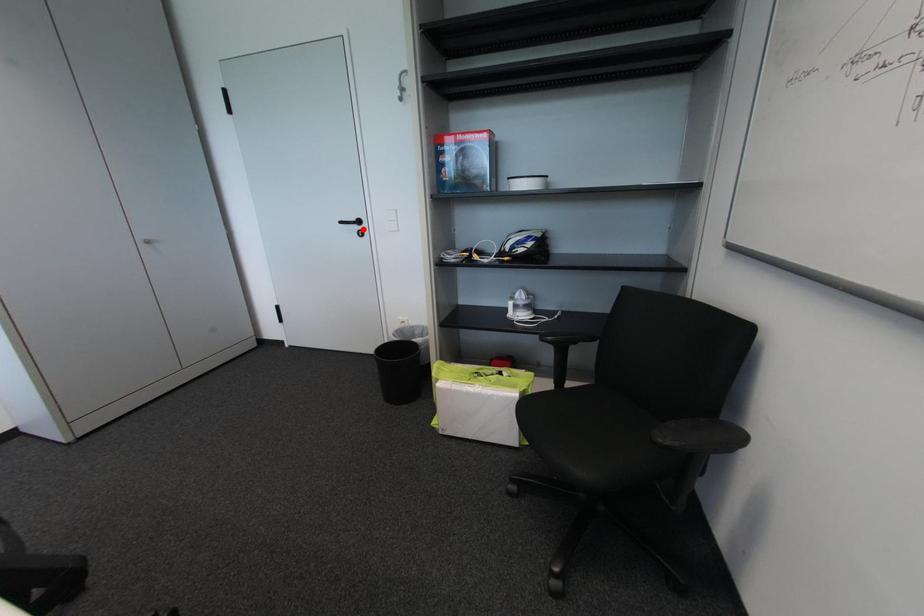
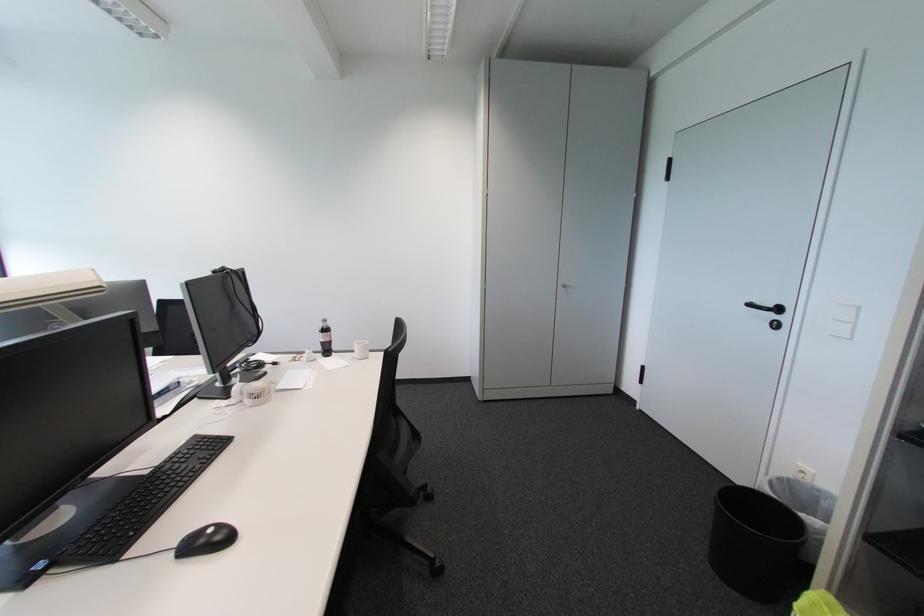
Where in the second image is the point corresponding to the highlighted location from the first image?

(777, 317)